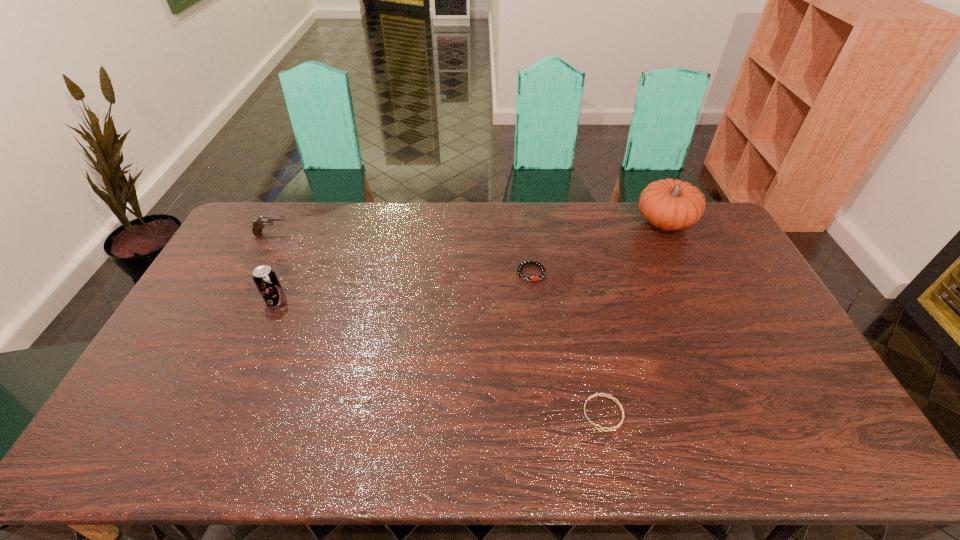
This screenshot has width=960, height=540. I want to click on vacant space located on the left of the soda can, so click(x=216, y=301).

Locate an element on the screen. The height and width of the screenshot is (540, 960). vacant region located at the barrel of the pistol is located at coordinates (369, 234).

This screenshot has height=540, width=960. I want to click on vacant space located 0.300m on the right of the left bracelet, so click(634, 273).

Find the location of `vacant space located on the surface of the nearest object showing star-shaped elements`. vacant space located on the surface of the nearest object showing star-shaped elements is located at coordinates (537, 413).

Identify the location of free space located on the surface of the nearest object showing star-shaped elements. (533, 413).

Locate an element on the screen. This screenshot has width=960, height=540. free space located 0.120m on the surface of the nearest object showing star-shaped elements is located at coordinates (537, 413).

In order to click on pumpkin that is at the far edge in this screenshot , I will do `click(669, 204)`.

The image size is (960, 540). I want to click on pistol present at the far edge, so click(259, 224).

This screenshot has width=960, height=540. Identify the location of object situated at the near edge. (597, 394).

Locate an element on the screen. The image size is (960, 540). object present at the left edge is located at coordinates (259, 224).